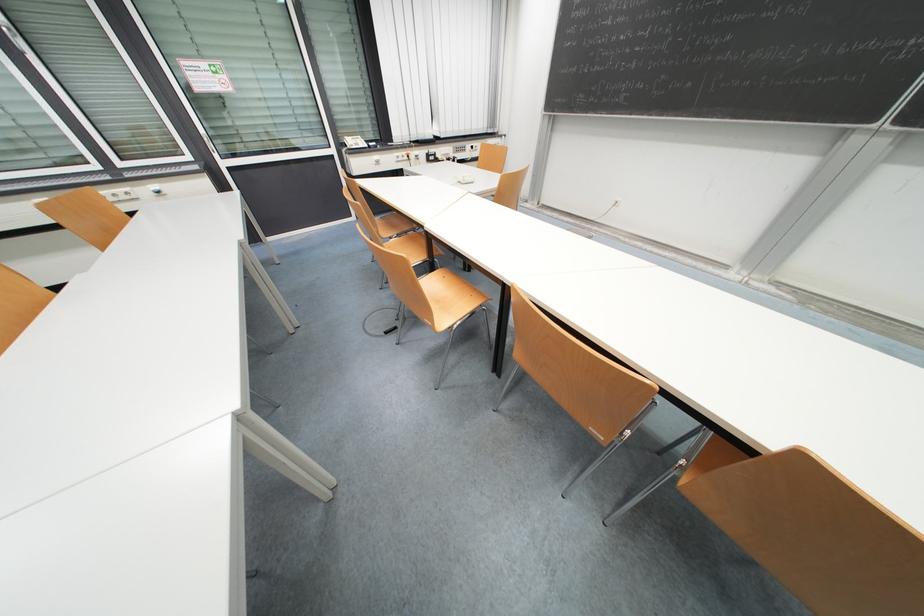
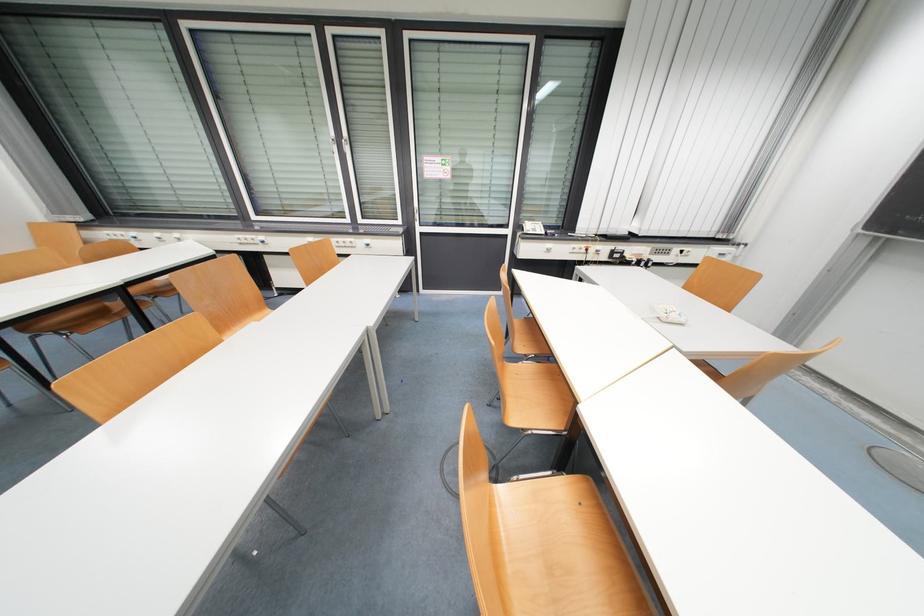
The point at (346, 146) is marked in the first image. Where is the corresponding point in the second image?

(524, 229)